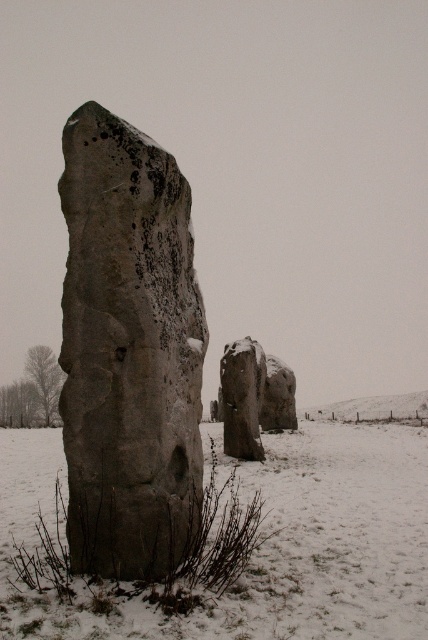
You are standing at the point marked as point (128,349) in the snowy landscape. Looking around, you see a rough stone monolith at center. What is the nearest object to your current position?

The nearest object to point (128,349) is the rough stone monolith at center, as the point is located on it.

Based on the coordinates provided, where is the rough stone monolith at center located in the image?

The rough stone monolith at center is located at the 2D coordinates point (128, 349) in the image.

You are an archaeologist examining the snowy landscape. You notice the rough stone monolith at center and the smooth gray rock at center. Which of these two objects is located to the left when viewed from your perspective?

The rough stone monolith at center is positioned on the left side of smooth gray rock at center, so it is located to the left when viewed from your perspective.